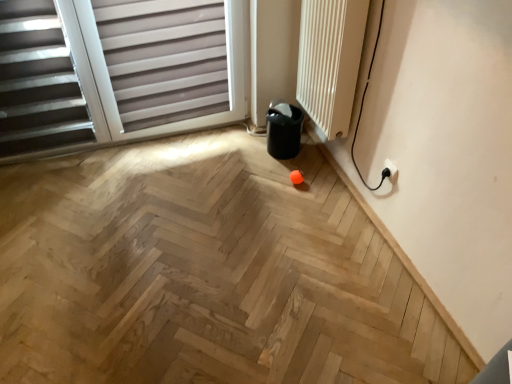
Question: From a real-world perspective, is white plastic electric outlet at lower right physically above natural wood floor at center?

Choices:
 (A) no
 (B) yes

Answer: (B)

Question: From the image's perspective, does white plastic electric outlet at lower right appear lower than natural wood floor at center?

Choices:
 (A) no
 (B) yes

Answer: (A)

Question: From the image's perspective, is white plastic electric outlet at lower right located above natural wood floor at center?

Choices:
 (A) no
 (B) yes

Answer: (B)

Question: Are white plastic electric outlet at lower right and natural wood floor at center far apart?

Choices:
 (A) yes
 (B) no

Answer: (B)

Question: Is white plastic electric outlet at lower right thinner than natural wood floor at center?

Choices:
 (A) no
 (B) yes

Answer: (B)

Question: Is matte gray blinds at upper left inside the boundaries of white textured radiator at upper right, or outside?

Choices:
 (A) outside
 (B) inside

Answer: (A)

Question: Is matte gray blinds at upper left bigger or smaller than white textured radiator at upper right?

Choices:
 (A) big
 (B) small

Answer: (A)

Question: From the image's perspective, is matte gray blinds at upper left positioned above or below white textured radiator at upper right?

Choices:
 (A) above
 (B) below

Answer: (B)

Question: From their relative heights in the image, would you say matte gray blinds at upper left is taller or shorter than white textured radiator at upper right?

Choices:
 (A) short
 (B) tall

Answer: (B)

Question: Is matte gray blinds at upper left wider or thinner than white plastic electric outlet at lower right?

Choices:
 (A) thin
 (B) wide

Answer: (B)

Question: Is matte gray blinds at upper left in front of or behind white plastic electric outlet at lower right in the image?

Choices:
 (A) front
 (B) behind

Answer: (A)

Question: From the image's perspective, is matte gray blinds at upper left positioned above or below white plastic electric outlet at lower right?

Choices:
 (A) below
 (B) above

Answer: (B)

Question: Visually, is matte gray blinds at upper left positioned to the left or to the right of white plastic electric outlet at lower right?

Choices:
 (A) left
 (B) right

Answer: (A)

Question: From the image's perspective, is white textured radiator at upper right positioned above or below matte gray blinds at upper left?

Choices:
 (A) above
 (B) below

Answer: (A)

Question: Considering the positions of white textured radiator at upper right and matte gray blinds at upper left in the image, is white textured radiator at upper right taller or shorter than matte gray blinds at upper left?

Choices:
 (A) short
 (B) tall

Answer: (A)